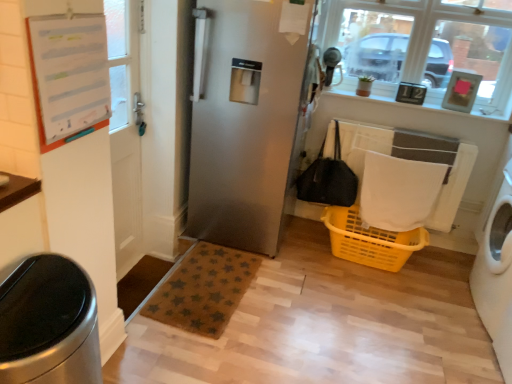
Where is `free space in front of yellow plastic laundry basket at lower center`? This screenshot has height=384, width=512. free space in front of yellow plastic laundry basket at lower center is located at coordinates (374, 309).